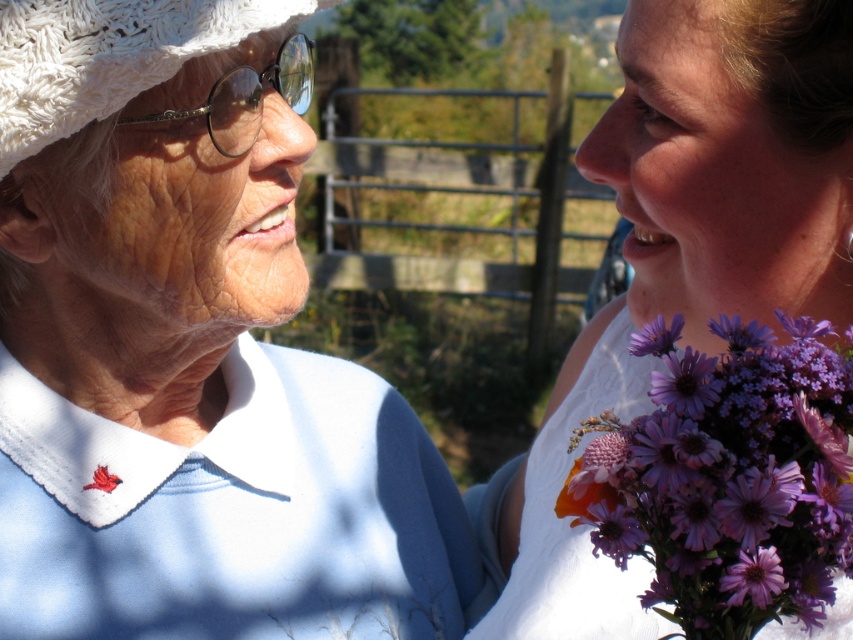
Who is higher up, white textured hat at upper left or purple floral bouquet at right?

purple floral bouquet at right is above.

Measure the distance between white textured hat at upper left and purple floral bouquet at right.

They are 11.75 inches apart.

Between point (96, 349) and point (838, 499), which one is positioned in front?

Positioned in front is point (838, 499).

This screenshot has height=640, width=853. What are the coordinates of `white textured hat at upper left` in the screenshot? It's located at (190, 356).

Is point (816, 580) closer to viewer compared to point (669, 328)?

Yes, it is in front of point (669, 328).

Between point (700, 508) and point (662, 348), which one is positioned in front?

Point (700, 508) is more forward.

You are a GUI agent. You are given a task and a screenshot of the screen. Output one action in this format:
    pyautogui.click(x=<x>, y=<y>)
    Task: Click on the purple floral bouquet at right
    This screenshot has width=853, height=640.
    Given the screenshot: What is the action you would take?
    pyautogui.click(x=727, y=476)

Is white textured hat at left in front of purple matte flower at upper right?

That is False.

Between point (33, 26) and point (631, 336), which one is positioned behind?

The point (631, 336) is more distant.

Between point (56, 102) and point (682, 324), which one is positioned in front?

Point (682, 324) is more forward.

Image resolution: width=853 pixels, height=640 pixels. What are the coordinates of `white textured hat at left` in the screenshot? It's located at (107, 54).